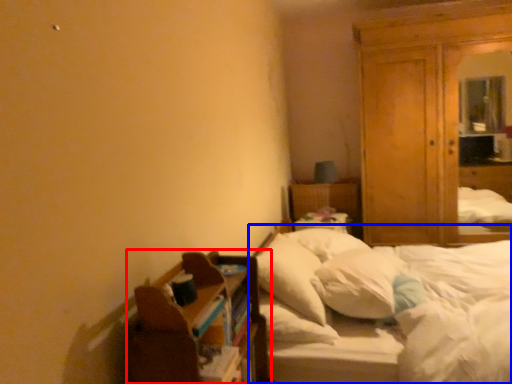
Question: Which object appears farthest to the camera in this image, shelf (highlighted by a red box) or bed (highlighted by a blue box)?

Choices:
 (A) shelf
 (B) bed

Answer: (B)